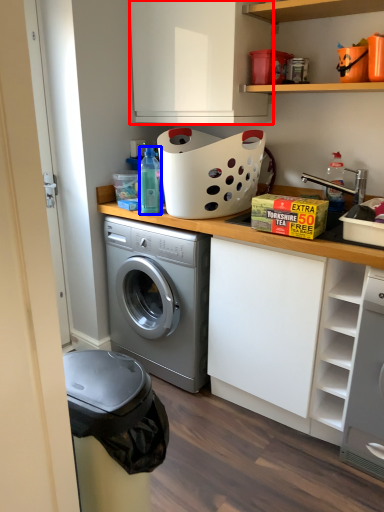
Question: Which point is further to the camera, cabinetry (highlighted by a red box) or bottle (highlighted by a blue box)?

Choices:
 (A) cabinetry
 (B) bottle

Answer: (B)